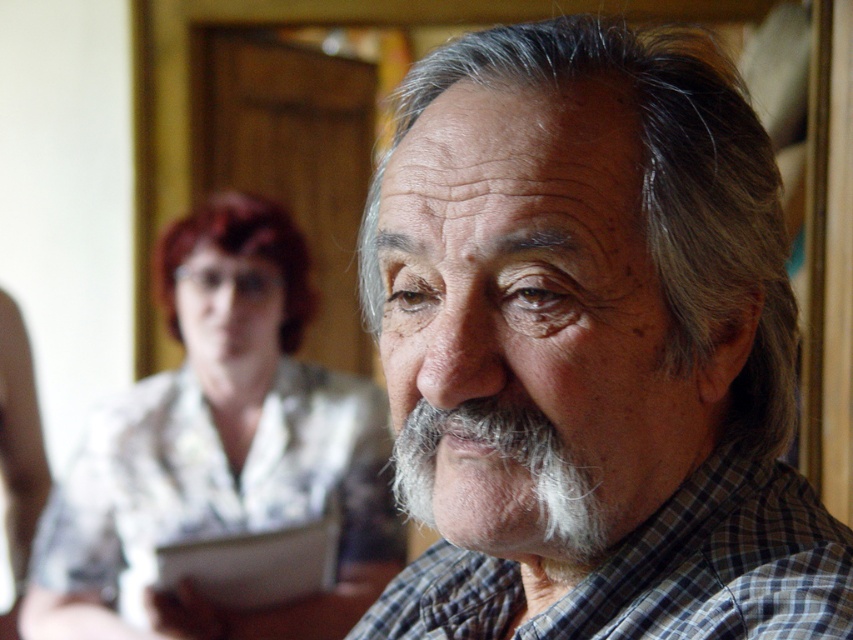
You are a tailor measuring two shirts in a room with wooden paneling. The shirts are the white floral blouse at center and the checkered fabric shirt at center. Which shirt has a larger width according to the measurements?

The white floral blouse at center has a larger width than the checkered fabric shirt at center according to the measurements.